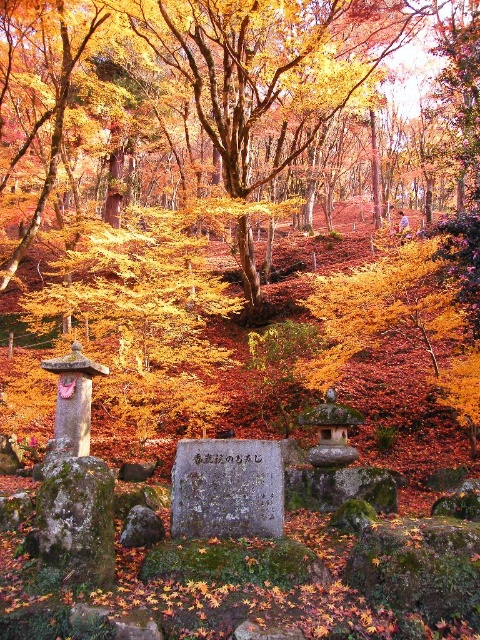
Question: Does gray stone plaque at center appear on the left side of green mossy stone at center?

Choices:
 (A) yes
 (B) no

Answer: (B)

Question: Which point is closer to the camera?

Choices:
 (A) (180, 532)
 (B) (48, 524)

Answer: (B)

Question: Can you confirm if gray stone plaque at center is wider than green mossy stone at center?

Choices:
 (A) no
 (B) yes

Answer: (B)

Question: From the image, what is the correct spatial relationship of gray stone plaque at center in relation to green mossy stone at center?

Choices:
 (A) above
 (B) below

Answer: (A)

Question: Which point is farther to the camera?

Choices:
 (A) gray stone plaque at center
 (B) green mossy stone at center

Answer: (A)

Question: Which object appears farthest from the camera in this image?

Choices:
 (A) gray stone plaque at center
 (B) green mossy stone at center

Answer: (A)